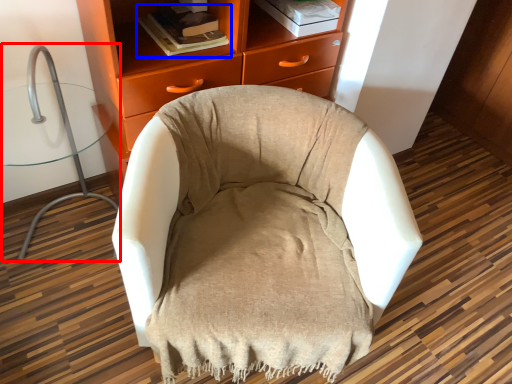
Question: Among these objects, which one is farthest to the camera, computer chair (highlighted by a red box) or book (highlighted by a blue box)?

Choices:
 (A) computer chair
 (B) book

Answer: (B)